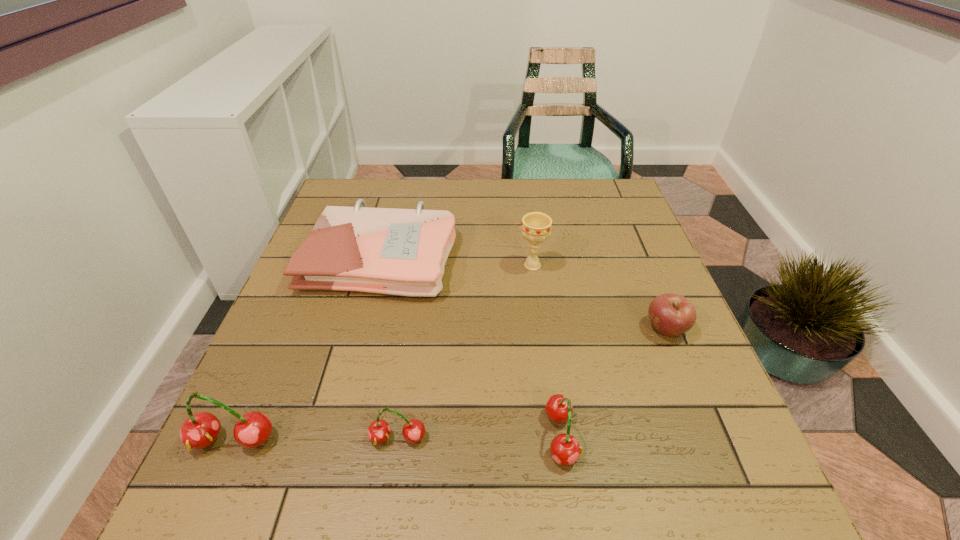
Identify the location of free space between the chalice and the second cherry from left to right. (466, 352).

Image resolution: width=960 pixels, height=540 pixels. Identify the location of empty location between the chalice and the apple. (599, 297).

The image size is (960, 540). What are the coordinates of `free spot between the phonebook and the fourth nearest object` in the screenshot? It's located at (524, 293).

Find the location of a particular element. The image size is (960, 540). vacant area that lies between the rightmost cherry and the phonebook is located at coordinates (471, 346).

Image resolution: width=960 pixels, height=540 pixels. What are the coordinates of `free space between the chalice and the tallest cherry` in the screenshot? It's located at point(383,353).

Find the location of `blank region between the chalice and the rightmost cherry`. blank region between the chalice and the rightmost cherry is located at coordinates pyautogui.click(x=547, y=350).

Locate an element on the screen. object that is the third closest to the chalice is located at coordinates (564, 448).

Locate an element on the screen. object that can be found as the fourth closest to the second cherry from right to left is located at coordinates (536, 226).

Find the location of a particular element. This screenshot has height=540, width=960. cherry that is the closest to the fourth nearest object is located at coordinates (564, 448).

Locate which cherry is the third closest to the rightmost object. Please provide its 2D coordinates. Your answer should be formatted as a tuple, i.e. [(x, y)], where the tuple contains the x and y coordinates of a point satisfying the conditions above.

[(200, 430)]